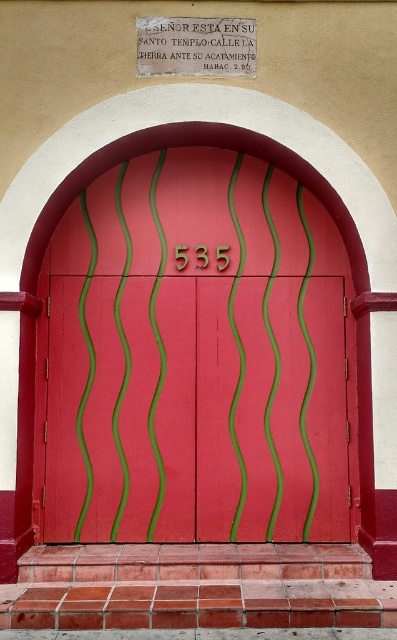
Question: Can you confirm if matte red wooden door at center is positioned to the left of matte white stone plaque at upper center?

Choices:
 (A) no
 (B) yes

Answer: (B)

Question: Which of the following is the farthest from the observer?

Choices:
 (A) matte red wooden door at center
 (B) matte white stone plaque at upper center

Answer: (A)

Question: Can you confirm if matte red wooden door at center is positioned to the left of matte white stone plaque at upper center?

Choices:
 (A) no
 (B) yes

Answer: (B)

Question: Does matte red wooden door at center have a smaller size compared to matte white stone plaque at upper center?

Choices:
 (A) no
 (B) yes

Answer: (A)